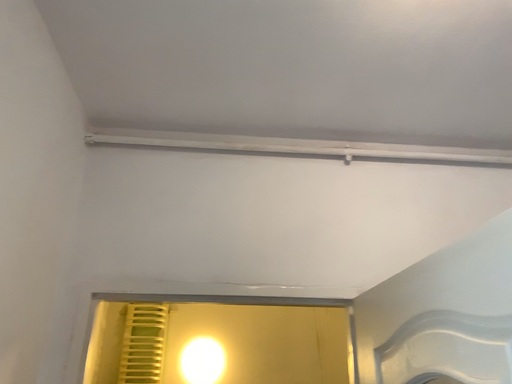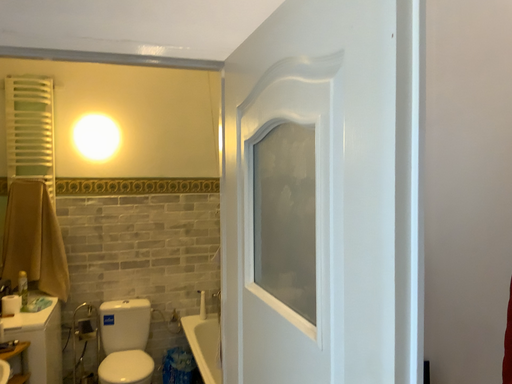
Question: Which way did the camera rotate in the video?

Choices:
 (A) rotated upward
 (B) rotated downward

Answer: (B)